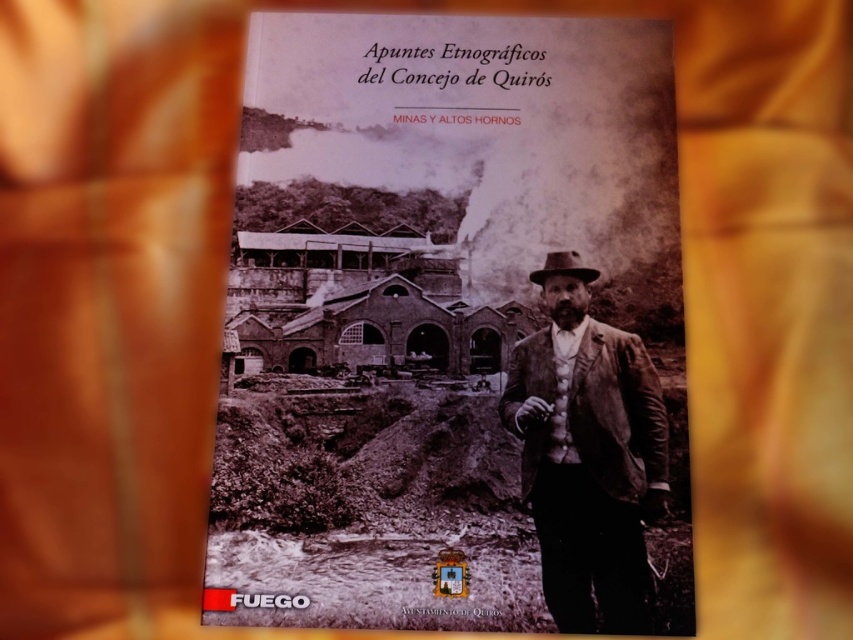
Question: Is sepia paper book cover at center above brown leather jacket at right?

Choices:
 (A) yes
 (B) no

Answer: (A)

Question: Is sepia paper book cover at center below brown leather jacket at right?

Choices:
 (A) no
 (B) yes

Answer: (A)

Question: Which of the following is the farthest from the observer?

Choices:
 (A) sepia paper book cover at center
 (B) brown leather jacket at right

Answer: (B)

Question: Does sepia paper book cover at center have a greater width compared to brown leather jacket at right?

Choices:
 (A) no
 (B) yes

Answer: (B)

Question: Which point is closer to the camera?

Choices:
 (A) (523, 500)
 (B) (492, 595)

Answer: (B)

Question: Which point appears farthest from the camera in this image?

Choices:
 (A) (297, 472)
 (B) (563, 269)

Answer: (B)